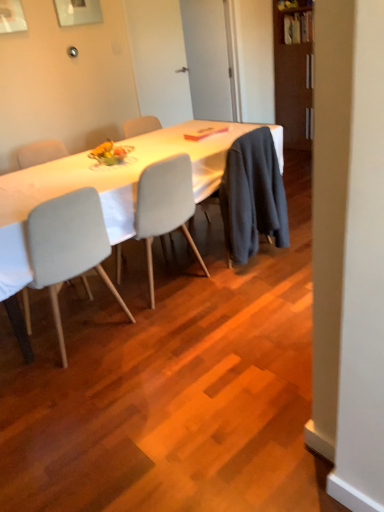
Question: Is matte white plate at center thinner than metallic silver picture frame at upper center?

Choices:
 (A) no
 (B) yes

Answer: (A)

Question: Would you say matte white plate at center contains metallic silver picture frame at upper center?

Choices:
 (A) no
 (B) yes

Answer: (A)

Question: Can you confirm if matte white plate at center is taller than metallic silver picture frame at upper center?

Choices:
 (A) yes
 (B) no

Answer: (B)

Question: Can you confirm if matte white plate at center is wider than metallic silver picture frame at upper center?

Choices:
 (A) no
 (B) yes

Answer: (B)

Question: Is matte white plate at center outside of metallic silver picture frame at upper center?

Choices:
 (A) yes
 (B) no

Answer: (A)

Question: Considering the positions of dark gray fabric robe at center and pink matte book at center in the image, is dark gray fabric robe at center wider or thinner than pink matte book at center?

Choices:
 (A) wide
 (B) thin

Answer: (A)

Question: Visually, is dark gray fabric robe at center positioned to the left or to the right of pink matte book at center?

Choices:
 (A) left
 (B) right

Answer: (B)

Question: Based on their sizes in the image, would you say dark gray fabric robe at center is bigger or smaller than pink matte book at center?

Choices:
 (A) small
 (B) big

Answer: (B)

Question: From a real-world perspective, is dark gray fabric robe at center physically located above or below pink matte book at center?

Choices:
 (A) below
 (B) above

Answer: (A)

Question: Looking at the image, does light gray fabric chair at center, which is the first chair in left-to-right order, seem bigger or smaller compared to light gray fabric chair at center, which ranks as the 2th chair in left-to-right order?

Choices:
 (A) small
 (B) big

Answer: (B)

Question: Relative to light gray fabric chair at center, which ranks as the 1th chair in right-to-left order, is light gray fabric chair at center, which ranks as the 2th chair in right-to-left order, in front or behind?

Choices:
 (A) behind
 (B) front

Answer: (B)

Question: In terms of height, does light gray fabric chair at center, which is the first chair in left-to-right order, look taller or shorter compared to light gray fabric chair at center, which ranks as the 2th chair in left-to-right order?

Choices:
 (A) short
 (B) tall

Answer: (B)

Question: Is light gray fabric chair at center, which ranks as the 2th chair in right-to-left order, wider or thinner than light gray fabric chair at center, which ranks as the 1th chair in right-to-left order?

Choices:
 (A) thin
 (B) wide

Answer: (B)

Question: Looking at the image, does white fabric table at center seem bigger or smaller compared to pink matte book at center?

Choices:
 (A) small
 (B) big

Answer: (B)

Question: From the image's perspective, is white fabric table at center positioned above or below pink matte book at center?

Choices:
 (A) above
 (B) below

Answer: (B)